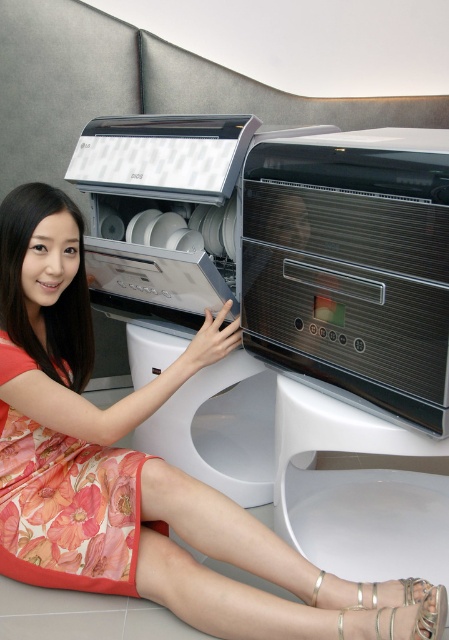
Can you confirm if white glossy dishwasher at center is thinner than pink floral dress at center?

Incorrect, white glossy dishwasher at center's width is not less than pink floral dress at center's.

Does white glossy dishwasher at center appear on the right side of pink floral dress at center?

Indeed, white glossy dishwasher at center is positioned on the right side of pink floral dress at center.

Is point (382, 164) closer to viewer compared to point (42, 288)?

Yes, point (382, 164) is in front of point (42, 288).

The width and height of the screenshot is (449, 640). I want to click on white glossy dishwasher at center, so click(284, 246).

Does point (113, 285) come in front of point (71, 502)?

No, it is not.

Can you confirm if white glossy dishwasher at center is smaller than floral silk dress at lower left?

No.

Who is more distant from viewer, [441,163] or [54,566]?

The point [54,566] is behind.

Find the location of `white glossy dishwasher at center`. white glossy dishwasher at center is located at coordinates (284, 246).

Who is lower down, pink floral dress at center or floral silk dress at lower left?

pink floral dress at center is lower down.

Is pink floral dress at center thinner than floral silk dress at lower left?

Incorrect, pink floral dress at center's width is not less than floral silk dress at lower left's.

Is point (34, 422) positioned before point (22, 440)?

No, (34, 422) is behind (22, 440).

Where is `pink floral dress at center`? pink floral dress at center is located at coordinates (140, 468).